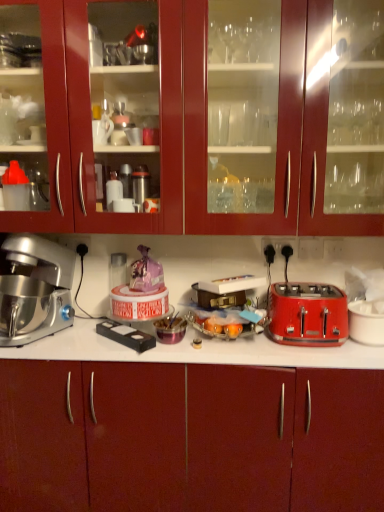
Question: Could you tell me if glossy wood cabinets at upper center, marked as the 1th cabinetry in a top-to-bottom arrangement, is facing black plastic electrical outlet at upper right?

Choices:
 (A) no
 (B) yes

Answer: (A)

Question: From the image's perspective, is glossy wood cabinets at upper center, the 2th cabinetry from the bottom, above black plastic electrical outlet at upper right?

Choices:
 (A) yes
 (B) no

Answer: (A)

Question: Is black plastic electrical outlet at upper right completely or partially inside glossy wood cabinets at upper center, the 2th cabinetry from the bottom?

Choices:
 (A) no
 (B) yes

Answer: (A)

Question: From a real-world perspective, is glossy wood cabinets at upper center, the 2th cabinetry from the bottom, beneath black plastic electrical outlet at upper right?

Choices:
 (A) yes
 (B) no

Answer: (B)

Question: Considering the relative positions of glossy wood cabinets at upper center, the 2th cabinetry from the bottom, and black plastic electrical outlet at upper right in the image provided, is glossy wood cabinets at upper center, the 2th cabinetry from the bottom, to the left of black plastic electrical outlet at upper right from the viewer's perspective?

Choices:
 (A) yes
 (B) no

Answer: (A)

Question: From a real-world perspective, relative to black plastic electrical outlet at upper right, is glossy wood cabinets at upper center, marked as the 1th cabinetry in a top-to-bottom arrangement, vertically above or below?

Choices:
 (A) above
 (B) below

Answer: (A)

Question: From the image's perspective, is glossy wood cabinets at upper center, marked as the 1th cabinetry in a top-to-bottom arrangement, located above or below black plastic electrical outlet at upper right?

Choices:
 (A) above
 (B) below

Answer: (A)

Question: Considering their positions, is glossy wood cabinets at upper center, marked as the 1th cabinetry in a top-to-bottom arrangement, located in front of or behind black plastic electrical outlet at upper right?

Choices:
 (A) front
 (B) behind

Answer: (A)

Question: Looking at the image, does glossy wood cabinets at upper center, marked as the 1th cabinetry in a top-to-bottom arrangement, seem bigger or smaller compared to black plastic electrical outlet at upper right?

Choices:
 (A) small
 (B) big

Answer: (B)

Question: Is silver metallic stand mixer at left bigger or smaller than black plastic electrical outlet at upper right?

Choices:
 (A) big
 (B) small

Answer: (A)

Question: Is silver metallic stand mixer at left to the left or to the right of black plastic electrical outlet at upper right in the image?

Choices:
 (A) left
 (B) right

Answer: (A)

Question: In the image, is silver metallic stand mixer at left positioned in front of or behind black plastic electrical outlet at upper right?

Choices:
 (A) behind
 (B) front

Answer: (B)

Question: From the image's perspective, is silver metallic stand mixer at left above or below black plastic electrical outlet at upper right?

Choices:
 (A) below
 (B) above

Answer: (A)

Question: Is silver metallic stand mixer at left situated inside red plastic toaster at right or outside?

Choices:
 (A) outside
 (B) inside

Answer: (A)

Question: From their relative heights in the image, would you say silver metallic stand mixer at left is taller or shorter than red plastic toaster at right?

Choices:
 (A) short
 (B) tall

Answer: (B)